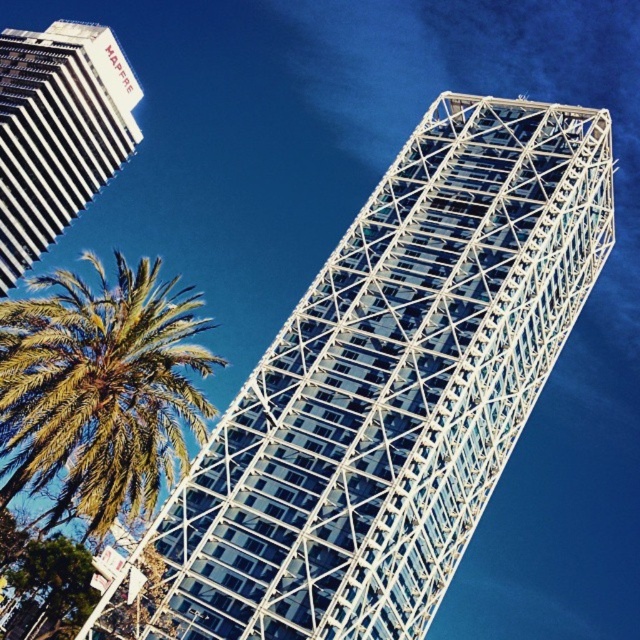
Is point (86, 474) less distant than point (61, 132)?

Yes, point (86, 474) is in front of point (61, 132).

Does green leafy palm tree at lower left have a greater width compared to white striped building at upper left?

Correct, the width of green leafy palm tree at lower left exceeds that of white striped building at upper left.

The height and width of the screenshot is (640, 640). I want to click on green leafy palm tree at lower left, so (x=99, y=390).

This screenshot has height=640, width=640. I want to click on green leafy palm tree at lower left, so click(x=99, y=390).

This screenshot has height=640, width=640. I want to click on white glass tower at center, so click(x=387, y=390).

Who is more forward, [332,525] or [42,113]?

Positioned in front is point [332,525].

Image resolution: width=640 pixels, height=640 pixels. In order to click on white glass tower at center in this screenshot , I will do `click(387, 390)`.

Which is below, white glass tower at center or green leafy palm tree at lower left?

green leafy palm tree at lower left is below.

Does white glass tower at center have a smaller size compared to green leafy palm tree at lower left?

Yes.

Image resolution: width=640 pixels, height=640 pixels. Identify the location of white glass tower at center. (387, 390).